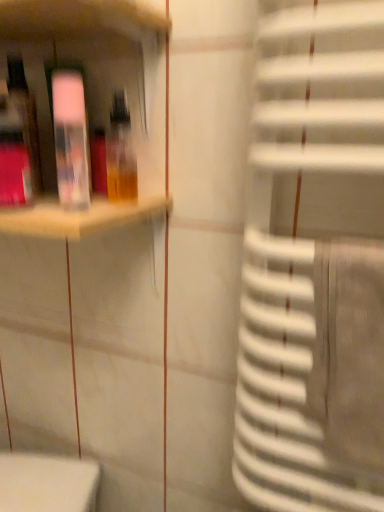
Question: Is matte plastic shelf at upper left at the right side of translucent plastic bottle at upper left, placed as the second bottle when sorted from left to right?

Choices:
 (A) no
 (B) yes

Answer: (A)

Question: Is matte plastic shelf at upper left not inside translucent plastic bottle at upper left, placed as the second bottle when sorted from left to right?

Choices:
 (A) yes
 (B) no

Answer: (A)

Question: From the image's perspective, is matte plastic shelf at upper left below translucent plastic bottle at upper left, placed as the second bottle when sorted from left to right?

Choices:
 (A) no
 (B) yes

Answer: (A)

Question: Is matte plastic shelf at upper left looking in the opposite direction of translucent plastic bottle at upper left, placed as the second bottle when sorted from left to right?

Choices:
 (A) no
 (B) yes

Answer: (B)

Question: From a real-world perspective, is matte plastic shelf at upper left positioned under translucent plastic bottle at upper left, placed as the second bottle when sorted from left to right, based on gravity?

Choices:
 (A) no
 (B) yes

Answer: (B)

Question: Based on their sizes in the image, would you say translucent plastic bottle at upper left, the first bottle viewed from the right, is bigger or smaller than transparent plastic bottle at upper left, the 2th bottle in the right-to-left sequence?

Choices:
 (A) big
 (B) small

Answer: (A)

Question: Considering the relative positions of translucent plastic bottle at upper left, placed as the second bottle when sorted from left to right, and transparent plastic bottle at upper left, placed as the 1th bottle when sorted from left to right, in the image provided, is translucent plastic bottle at upper left, placed as the second bottle when sorted from left to right, to the left or to the right of transparent plastic bottle at upper left, placed as the 1th bottle when sorted from left to right,?

Choices:
 (A) right
 (B) left

Answer: (A)

Question: Is translucent plastic bottle at upper left, the first bottle viewed from the right, in front of or behind transparent plastic bottle at upper left, the 2th bottle in the right-to-left sequence, in the image?

Choices:
 (A) front
 (B) behind

Answer: (B)

Question: Is point (114, 147) positioned closer to the camera than point (57, 115)?

Choices:
 (A) farther
 (B) closer

Answer: (A)

Question: Which is correct: matte plastic shelf at upper left is inside transparent plastic bottle at upper left, placed as the 1th bottle when sorted from left to right, or outside of it?

Choices:
 (A) outside
 (B) inside

Answer: (A)

Question: From a real-world perspective, is matte plastic shelf at upper left positioned above or below transparent plastic bottle at upper left, placed as the 1th bottle when sorted from left to right?

Choices:
 (A) below
 (B) above

Answer: (A)

Question: Looking at the image, does matte plastic shelf at upper left seem bigger or smaller compared to transparent plastic bottle at upper left, the 2th bottle in the right-to-left sequence?

Choices:
 (A) big
 (B) small

Answer: (A)

Question: Considering their positions, is matte plastic shelf at upper left located in front of or behind transparent plastic bottle at upper left, placed as the 1th bottle when sorted from left to right?

Choices:
 (A) front
 (B) behind

Answer: (A)

Question: From their relative heights in the image, would you say transparent plastic bottle at upper left, the 2th bottle in the right-to-left sequence, is taller or shorter than matte plastic shelf at upper left?

Choices:
 (A) short
 (B) tall

Answer: (A)

Question: Which is correct: transparent plastic bottle at upper left, the 2th bottle in the right-to-left sequence, is inside matte plastic shelf at upper left, or outside of it?

Choices:
 (A) inside
 (B) outside

Answer: (A)